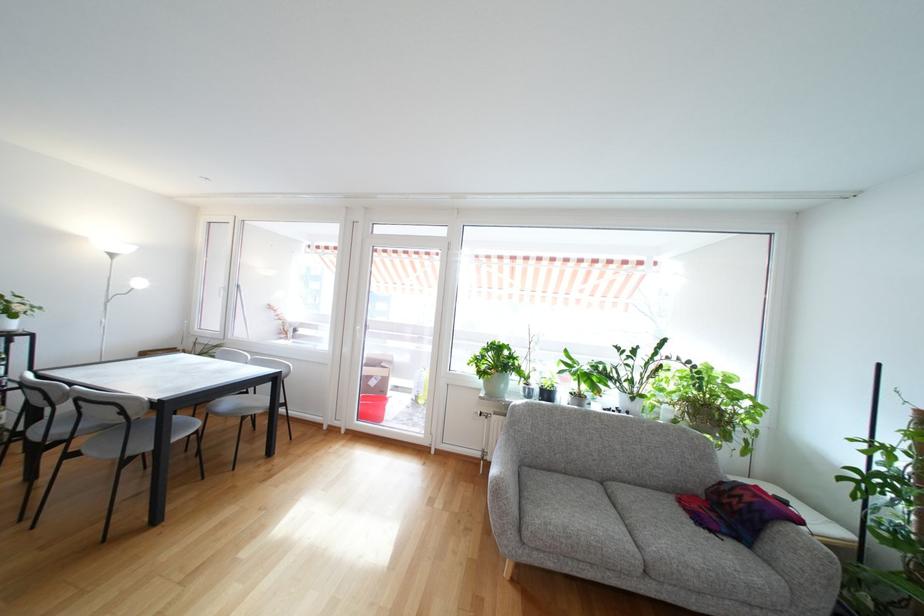
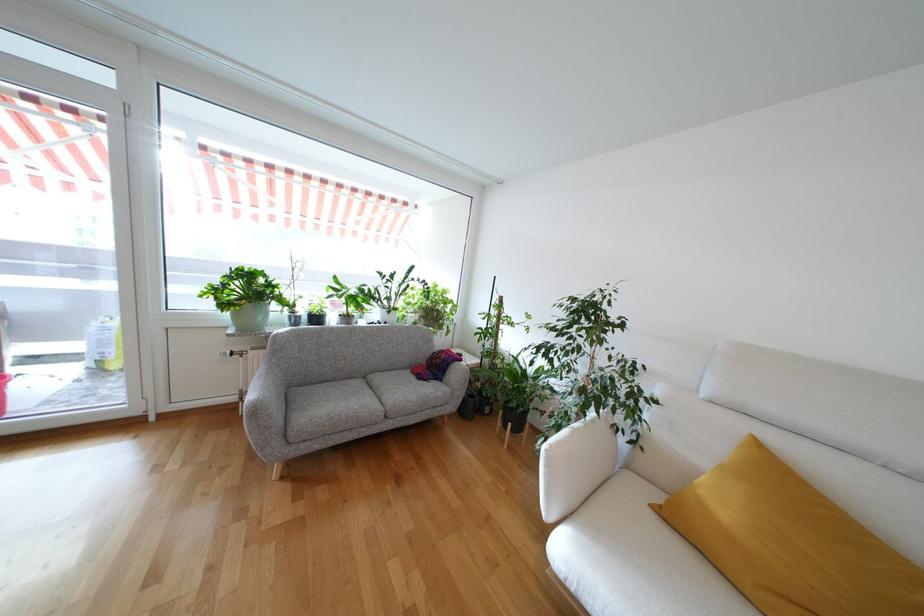
Locate, in the second image, the point that corresponds to (x=476, y=367) in the first image.

(212, 300)